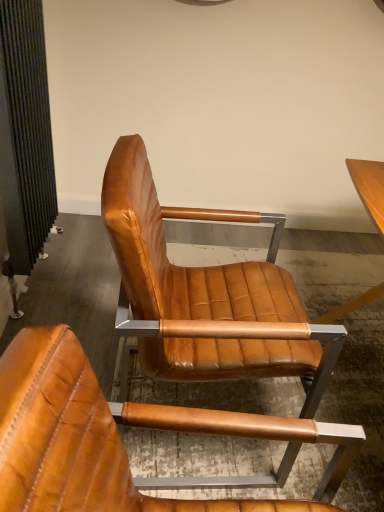
What do you see at coordinates (53, 425) in the screenshot? I see `cognac leather chair at center, placed as the 2th chair when sorted from back to front` at bounding box center [53, 425].

You are a GUI agent. You are given a task and a screenshot of the screen. Output one action in this format:
    pyautogui.click(x=<x>, y=<y>)
    Task: Click on the cognac leather chair at center, placed as the 2th chair when sorted from back to front
    This screenshot has height=512, width=384.
    Given the screenshot: What is the action you would take?
    pyautogui.click(x=53, y=425)

This screenshot has width=384, height=512. What do you see at coordinates (210, 314) in the screenshot?
I see `cognac leather chair at center, the second chair viewed from the front` at bounding box center [210, 314].

What is the approximate width of cognac leather chair at center, the second chair viewed from the front?

cognac leather chair at center, the second chair viewed from the front, is 25.65 inches wide.

At what (x,y) coordinates should I click in order to perform the action: click on cognac leather chair at center, which is the 1th chair in back-to-front order. Please return your answer as a coordinate pair (x, y). Image resolution: width=384 pixels, height=512 pixels. Looking at the image, I should click on (210, 314).

Where is `cognac leather chair at center, marked as the first chair in a front-to-back arrangement`? The image size is (384, 512). cognac leather chair at center, marked as the first chair in a front-to-back arrangement is located at coordinates (53, 425).

Is cognac leather chair at center, marked as the first chair in a front-to-back arrangement, to the left or to the right of cognac leather chair at center, the second chair viewed from the front, in the image?

cognac leather chair at center, marked as the first chair in a front-to-back arrangement, is to the left of cognac leather chair at center, the second chair viewed from the front.

Is cognac leather chair at center, marked as the first chair in a front-to-back arrangement, closer to the viewer compared to cognac leather chair at center, the second chair viewed from the front?

Yes, cognac leather chair at center, marked as the first chair in a front-to-back arrangement, is closer to the camera.

Which is less distant, (64, 375) or (307, 420)?

Point (64, 375) appears to be closer to the viewer than point (307, 420).

From the image's perspective, is cognac leather chair at center, placed as the 2th chair when sorted from back to front, positioned above or below cognac leather chair at center, which is the 1th chair in back-to-front order?

From the image's perspective, cognac leather chair at center, placed as the 2th chair when sorted from back to front, appears below cognac leather chair at center, which is the 1th chair in back-to-front order.

From the picture: From a real-world perspective, which object stands above the other?

→ cognac leather chair at center, marked as the first chair in a front-to-back arrangement.

Considering the sizes of objects cognac leather chair at center, placed as the 2th chair when sorted from back to front, and cognac leather chair at center, which is the 1th chair in back-to-front order, in the image provided, who is wider, cognac leather chair at center, placed as the 2th chair when sorted from back to front, or cognac leather chair at center, which is the 1th chair in back-to-front order,?

cognac leather chair at center, which is the 1th chair in back-to-front order.

Is cognac leather chair at center, placed as the 2th chair when sorted from back to front, shorter than cognac leather chair at center, which is the 1th chair in back-to-front order?

Yes.

Can you confirm if cognac leather chair at center, marked as the first chair in a front-to-back arrangement, is smaller than cognac leather chair at center, which is the 1th chair in back-to-front order?

Indeed, cognac leather chair at center, marked as the first chair in a front-to-back arrangement, has a smaller size compared to cognac leather chair at center, which is the 1th chair in back-to-front order.

From the picture: Is cognac leather chair at center, placed as the 2th chair when sorted from back to front, not inside cognac leather chair at center, the second chair viewed from the front?

Yes, cognac leather chair at center, placed as the 2th chair when sorted from back to front, is not within cognac leather chair at center, the second chair viewed from the front.

Is the surface of cognac leather chair at center, placed as the 2th chair when sorted from back to front, in direct contact with cognac leather chair at center, the second chair viewed from the front?

No, cognac leather chair at center, placed as the 2th chair when sorted from back to front, is not making contact with cognac leather chair at center, the second chair viewed from the front.

Is cognac leather chair at center, marked as the first chair in a front-to-back arrangement, looking in the opposite direction of cognac leather chair at center, which is the 1th chair in back-to-front order?

No, cognac leather chair at center, marked as the first chair in a front-to-back arrangement, is not facing away from cognac leather chair at center, which is the 1th chair in back-to-front order.

Locate an element on the screen. The height and width of the screenshot is (512, 384). chair in front of the cognac leather chair at center, the second chair viewed from the front is located at coordinates (53, 425).

Can you confirm if cognac leather chair at center, which is the 1th chair in back-to-front order, is positioned to the right of cognac leather chair at center, placed as the 2th chair when sorted from back to front?

Indeed, cognac leather chair at center, which is the 1th chair in back-to-front order, is positioned on the right side of cognac leather chair at center, placed as the 2th chair when sorted from back to front.

Is cognac leather chair at center, which is the 1th chair in back-to-front order, positioned before cognac leather chair at center, placed as the 2th chair when sorted from back to front?

No, cognac leather chair at center, which is the 1th chair in back-to-front order, is behind cognac leather chair at center, placed as the 2th chair when sorted from back to front.

Which is behind, point (154, 324) or point (94, 407)?

The point (154, 324) is farther from the camera.

From the image's perspective, is cognac leather chair at center, the second chair viewed from the front, beneath cognac leather chair at center, placed as the 2th chair when sorted from back to front?

No.

From a real-world perspective, which is physically below, cognac leather chair at center, the second chair viewed from the front, or cognac leather chair at center, placed as the 2th chair when sorted from back to front?

cognac leather chair at center, the second chair viewed from the front.

Does cognac leather chair at center, the second chair viewed from the front, have a greater width compared to cognac leather chair at center, placed as the 2th chair when sorted from back to front?

Yes, cognac leather chair at center, the second chair viewed from the front, is wider than cognac leather chair at center, placed as the 2th chair when sorted from back to front.

Which of these two, cognac leather chair at center, the second chair viewed from the front, or cognac leather chair at center, marked as the first chair in a front-to-back arrangement, stands shorter?

Standing shorter between the two is cognac leather chair at center, marked as the first chair in a front-to-back arrangement.

Does cognac leather chair at center, which is the 1th chair in back-to-front order, have a smaller size compared to cognac leather chair at center, placed as the 2th chair when sorted from back to front?

No, cognac leather chair at center, which is the 1th chair in back-to-front order, is not smaller than cognac leather chair at center, placed as the 2th chair when sorted from back to front.

Could cognac leather chair at center, placed as the 2th chair when sorted from back to front, be considered to be inside cognac leather chair at center, the second chair viewed from the front?

No, cognac leather chair at center, placed as the 2th chair when sorted from back to front, is not inside cognac leather chair at center, the second chair viewed from the front.

Is cognac leather chair at center, the second chair viewed from the front, far away from cognac leather chair at center, placed as the 2th chair when sorted from back to front?

Actually, cognac leather chair at center, the second chair viewed from the front, and cognac leather chair at center, placed as the 2th chair when sorted from back to front, are a little close together.

Could you tell me if cognac leather chair at center, which is the 1th chair in back-to-front order, is turned towards cognac leather chair at center, placed as the 2th chair when sorted from back to front?

No, cognac leather chair at center, which is the 1th chair in back-to-front order, is not aimed at cognac leather chair at center, placed as the 2th chair when sorted from back to front.

Can you tell me how much cognac leather chair at center, the second chair viewed from the front, and cognac leather chair at center, marked as the first chair in a front-to-back arrangement, differ in facing direction?

The facing directions of cognac leather chair at center, the second chair viewed from the front, and cognac leather chair at center, marked as the first chair in a front-to-back arrangement, are 4.02 degrees apart.

Where is `chair that appears below the cognac leather chair at center, placed as the 2th chair when sorted from back to front (from a real-world perspective)`? The image size is (384, 512). chair that appears below the cognac leather chair at center, placed as the 2th chair when sorted from back to front (from a real-world perspective) is located at coordinates (210, 314).

Image resolution: width=384 pixels, height=512 pixels. I want to click on chair lying in front of the cognac leather chair at center, which is the 1th chair in back-to-front order, so 53,425.

The width and height of the screenshot is (384, 512). Find the location of `chair behind the cognac leather chair at center, marked as the first chair in a front-to-back arrangement`. chair behind the cognac leather chair at center, marked as the first chair in a front-to-back arrangement is located at coordinates (210, 314).